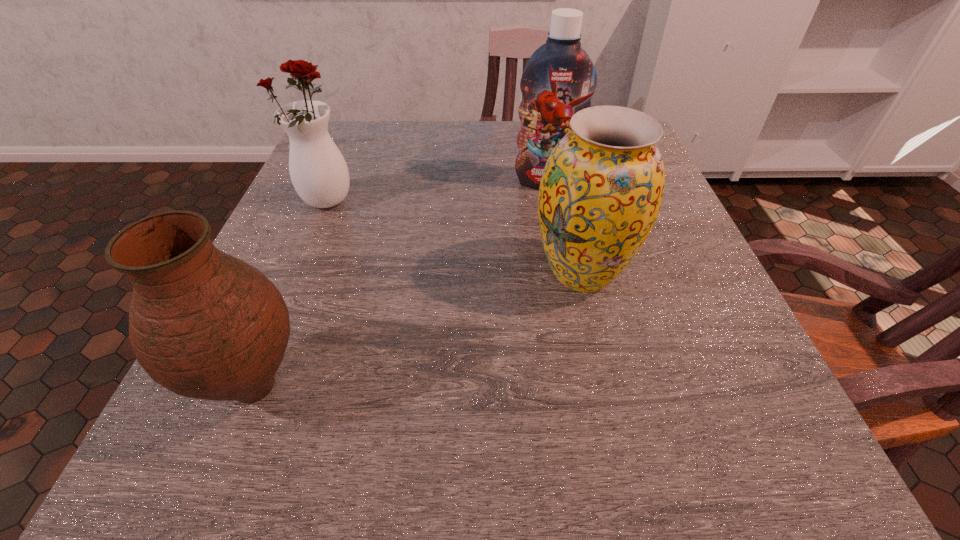
Identify the location of vacant space that is in between the nearest vase and the second nearest vase. (419, 330).

This screenshot has height=540, width=960. In order to click on free space between the farthest vase and the nearest object in this screenshot , I will do (x=291, y=295).

I want to click on vacant point located between the shampoo and the farthest vase, so click(x=437, y=192).

This screenshot has width=960, height=540. Identify the location of unoccupied area between the shampoo and the nearest object. (400, 284).

Where is `blank region between the shampoo and the nearest vase`? This screenshot has width=960, height=540. blank region between the shampoo and the nearest vase is located at coordinates (400, 284).

Identify the location of free space between the farthest vase and the nearest vase. The width and height of the screenshot is (960, 540). (291, 295).

Point out which object is positioned as the second nearest to the shampoo. Please provide its 2D coordinates. Your answer should be formatted as a tuple, i.e. [(x, y)], where the tuple contains the x and y coordinates of a point satisfying the conditions above.

[(318, 171)]

Identify the location of object that stands as the closest to the nearest vase. The width and height of the screenshot is (960, 540). (318, 171).

Find the location of a particular element. The image size is (960, 540). vase that is the closest one to the farthest vase is located at coordinates (203, 324).

Locate which vase is the second closest to the nearest object. Please provide its 2D coordinates. Your answer should be formatted as a tuple, i.e. [(x, y)], where the tuple contains the x and y coordinates of a point satisfying the conditions above.

[(601, 190)]